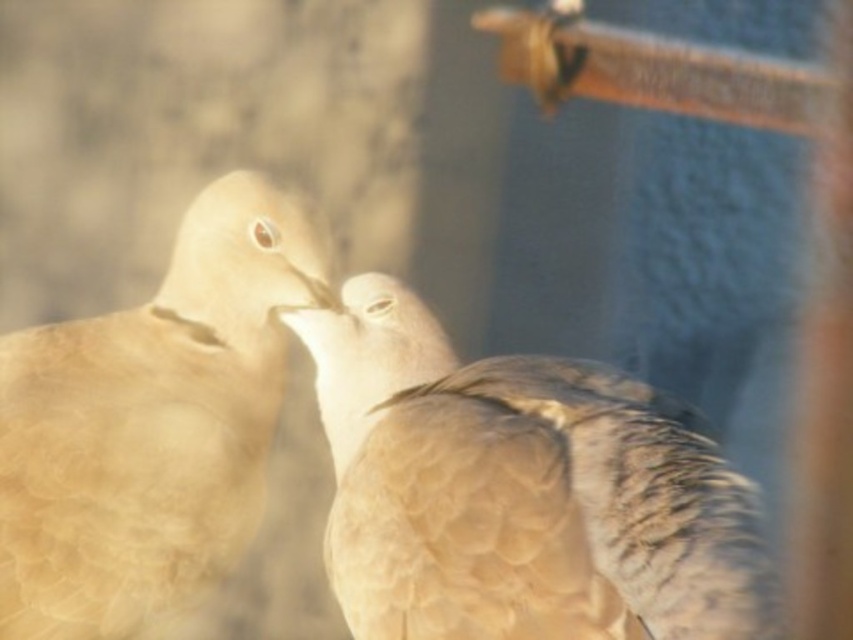
You are observing two points in the image of the birds. Which point, point (334, 586) or point (96, 481), is closer to the camera?

Point (334, 586) is further to the camera than point (96, 481), so the closer point to the camera is point (96, 481).

You are a photographer wanting to capture the brown feathered bird at center and the matte beige bird at center in a closeup shot. Since you want to highlight their size difference, which bird should you focus on to ensure the size difference is clearly visible in the photo?

The brown feathered bird at center is larger than the matte beige bird at center, so focusing on the brown feathered bird at center will emphasize the size difference between them.

Based on the photo, you are a photographer trying to capture the interaction between the brown feathered bird at center and the matte beige bird at center. Which bird should you focus on if you want to photograph the one closer to the bottom of the image?

The brown feathered bird at center is below matte beige bird at center, so you should focus on the brown feathered bird at center to capture the one closer to the bottom of the image.